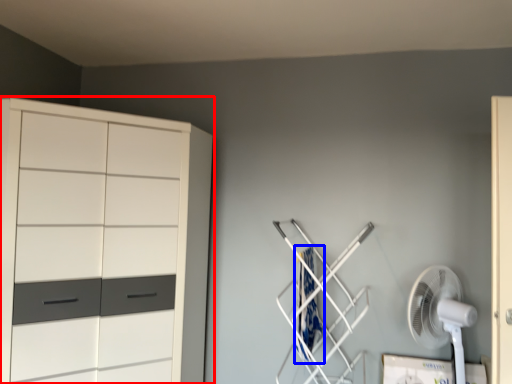
Question: Which of the following is the closest to the observer, cupboard (highlighted by a red box) or laundry (highlighted by a blue box)?

Choices:
 (A) cupboard
 (B) laundry

Answer: (A)